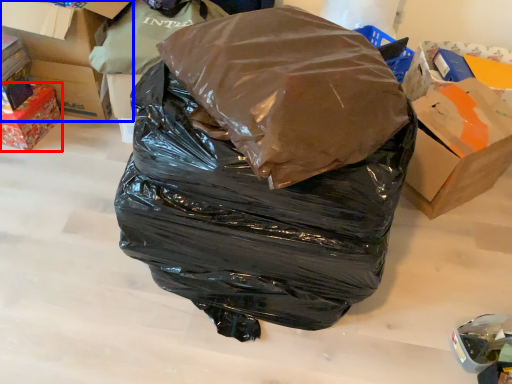
Question: Which of the following is the farthest to the observer, box (highlighted by a red box) or box (highlighted by a blue box)?

Choices:
 (A) box
 (B) box

Answer: (B)